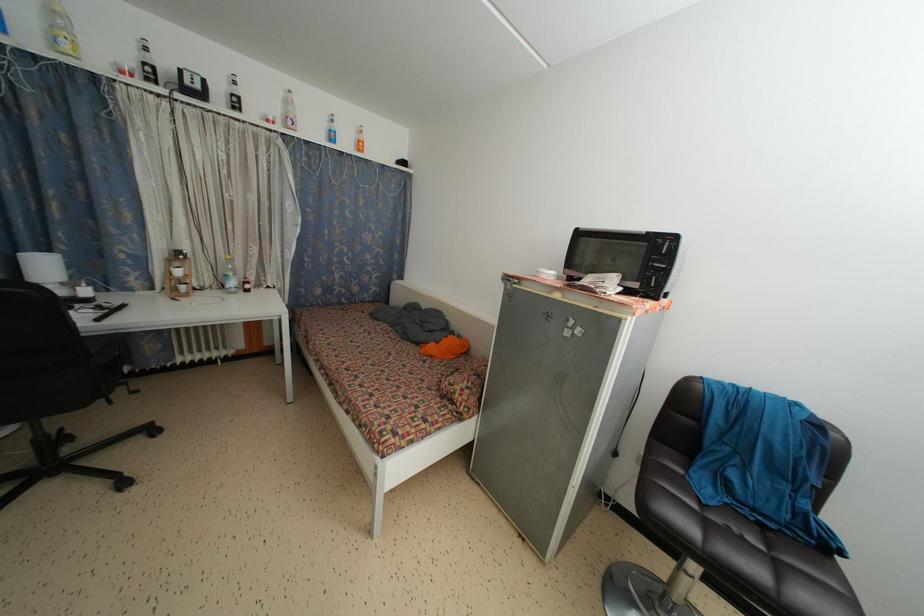
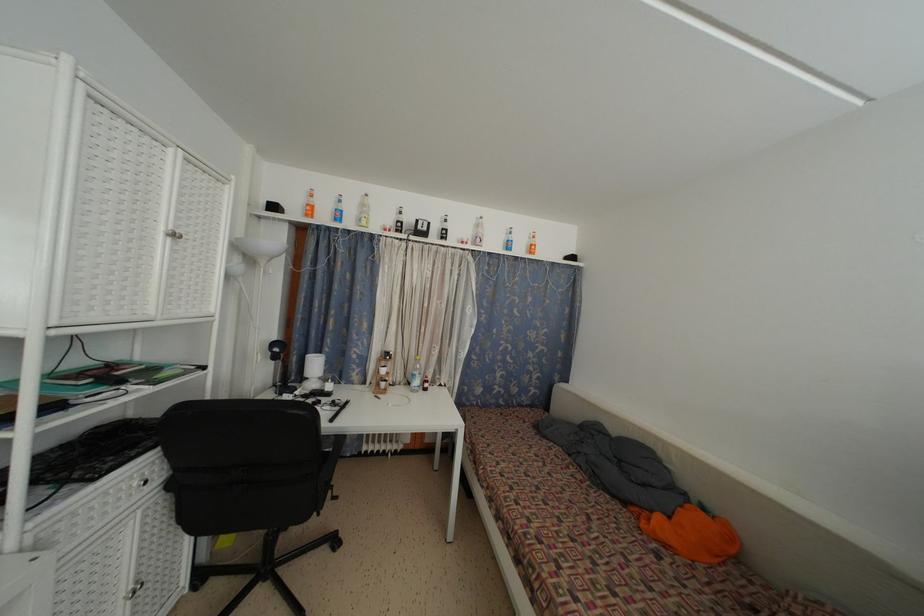
Find the pixel in the second image that matches (x=290, y=108) in the first image.

(481, 232)